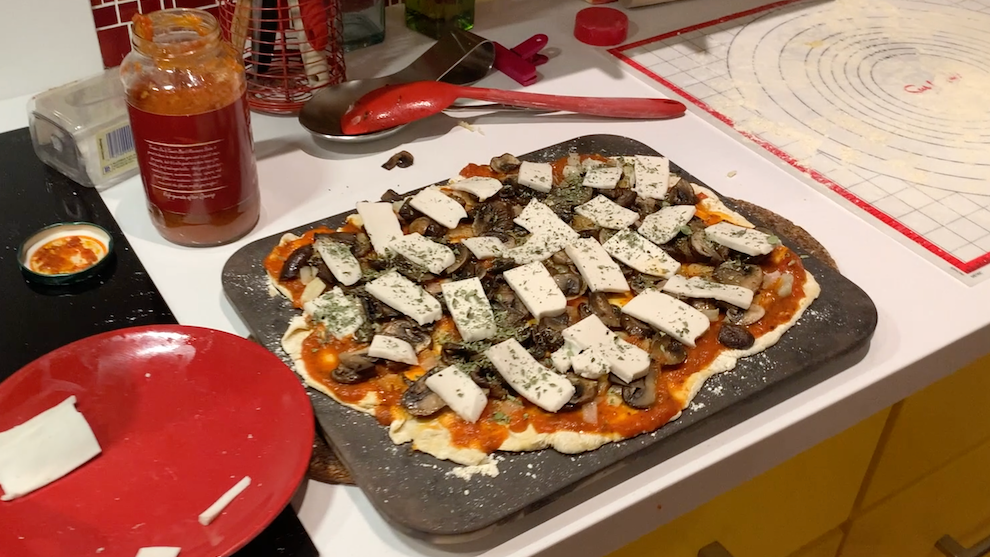
Locate an element on the screen. cabinet is located at coordinates (943, 432).